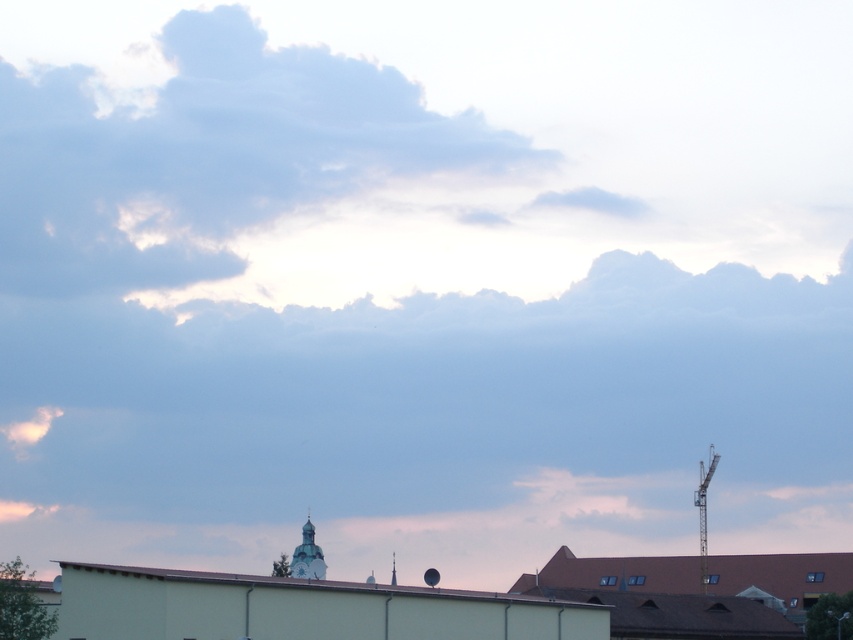
Question: Which object is closer to the camera taking this photo?

Choices:
 (A) metallic gray crane at right
 (B) white stone tower at center

Answer: (B)

Question: Can you confirm if white stone tower at center is smaller than metallic silver clock at center?

Choices:
 (A) no
 (B) yes

Answer: (A)

Question: Can you confirm if white stone tower at center is positioned above metallic silver clock at center?

Choices:
 (A) no
 (B) yes

Answer: (B)

Question: Which object appears closest to the camera in this image?

Choices:
 (A) white stone tower at center
 (B) metallic gray crane at right

Answer: (A)

Question: Is white stone tower at center bigger than metallic gray crane at right?

Choices:
 (A) yes
 (B) no

Answer: (B)

Question: Which of the following is the closest to the observer?

Choices:
 (A) (300, 570)
 (B) (701, 593)

Answer: (B)